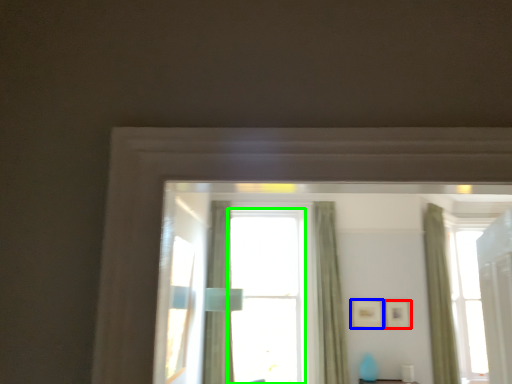
Question: Estimate the real-world distances between objects in this image. Which object is closer to picture frame (highlighted by a red box), picture frame (highlighted by a blue box) or window (highlighted by a green box)?

Choices:
 (A) picture frame
 (B) window

Answer: (A)